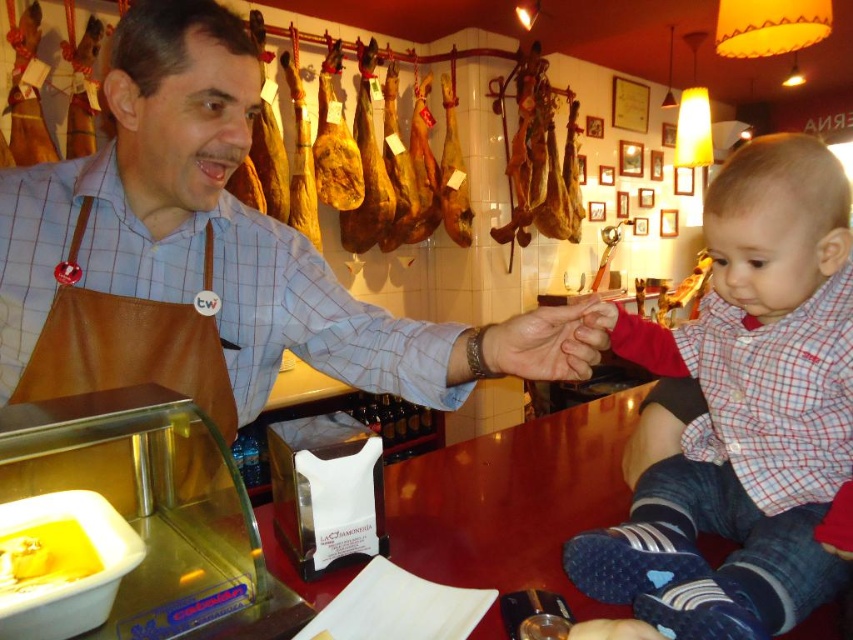
Question: Estimate the real-world distances between objects in this image. Which object is closer to the dry skin at center?

Choices:
 (A) checkered fabric shirt at right
 (B) yellow creamy cheese at lower left
 (C) brown leather apron at center

Answer: (A)

Question: Can you confirm if brown leather apron at center is positioned above checkered fabric shirt at right?

Choices:
 (A) no
 (B) yes

Answer: (B)

Question: Which object is the farthest from the yellow creamy cheese at lower left?

Choices:
 (A) checkered fabric shirt at right
 (B) dry skin at center

Answer: (A)

Question: Which of the following is the farthest from the observer?

Choices:
 (A) (708, 588)
 (B) (543, 316)
 (C) (33, 396)
 (D) (86, 536)

Answer: (C)

Question: Is brown leather apron at center further to the viewer compared to yellow creamy cheese at lower left?

Choices:
 (A) no
 (B) yes

Answer: (B)

Question: Can you confirm if brown leather apron at center is positioned to the left of checkered fabric shirt at right?

Choices:
 (A) yes
 (B) no

Answer: (A)